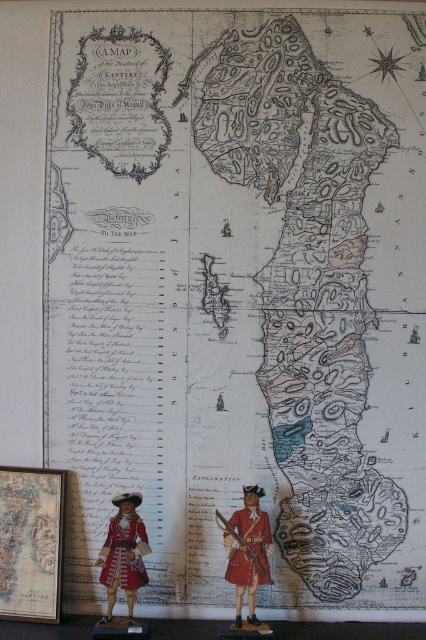
You are examining the historical map of the Isle of Jura. You notice two points marked on the map at coordinates point (232, 563) and point (134, 552). If you were to walk from one point to the other, which point would you physically reach first based on their positions on the map?

You would reach point (232, 563) first because it is closer to the camera than point (134, 552), meaning it is positioned in front of the other point on the map.